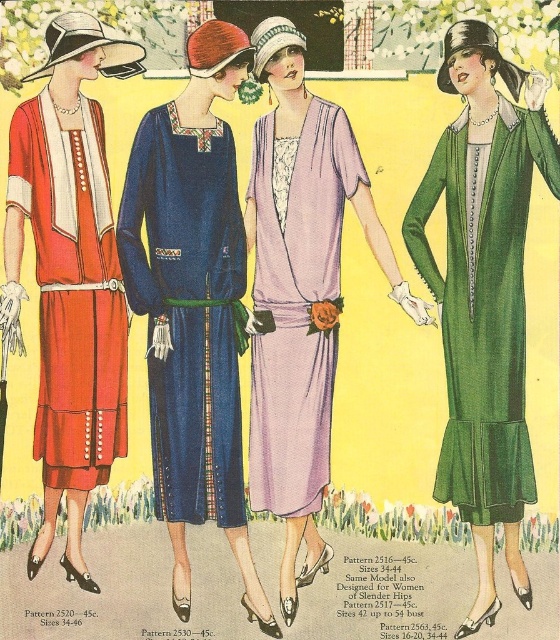
Looking at the vintage advertisement, there are two dresses at the center of the image. The velvet blue dress at center and the lavender silk dress at center. Which dress is wider?

The velvet blue dress at center is wider than the lavender silk dress at center.

You are a fashion designer observing this vintage ad. You notice the shiny green coat at right and the lavender silk dress at center. Which one is positioned closer to the viewer?

The shiny green coat at right is closer to the viewer because the lavender silk dress at center is behind it.

Based on the coordinates provided in the image, where exactly is the velvet blue dress at center located?

The velvet blue dress at center is located at the coordinates point (193, 305).